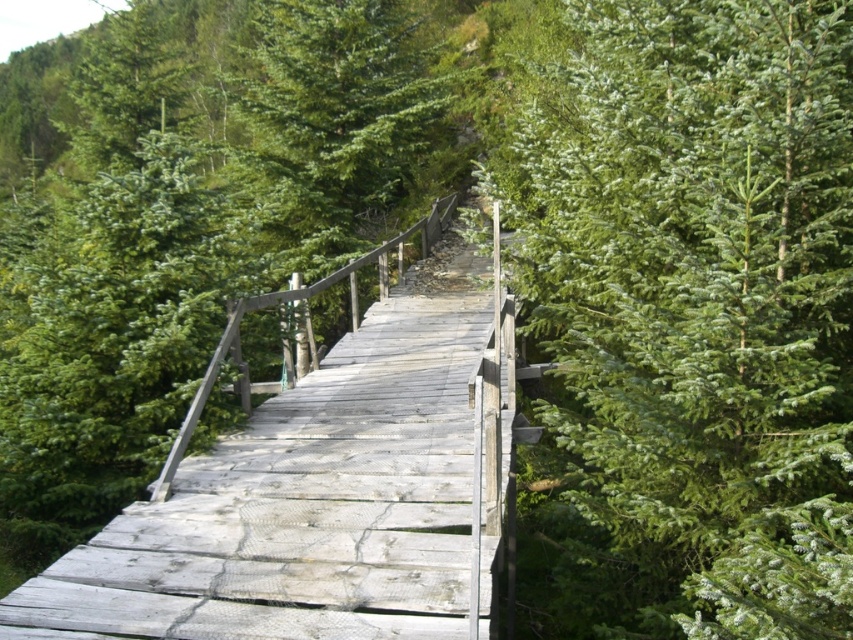
Question: Can you confirm if green matte tree at upper right is wider than weathered wood bridge at center?

Choices:
 (A) yes
 (B) no

Answer: (B)

Question: Which of the following is the closest to the observer?

Choices:
 (A) weathered wood bridge at center
 (B) green matte tree at upper right

Answer: (A)

Question: Is green matte tree at upper right behind weathered wood bridge at center?

Choices:
 (A) yes
 (B) no

Answer: (A)

Question: Which object is closer to the camera taking this photo?

Choices:
 (A) weathered wood bridge at center
 (B) green matte tree at upper right

Answer: (A)

Question: Can you confirm if green matte tree at upper right is positioned to the right of weathered wood bridge at center?

Choices:
 (A) no
 (B) yes

Answer: (B)